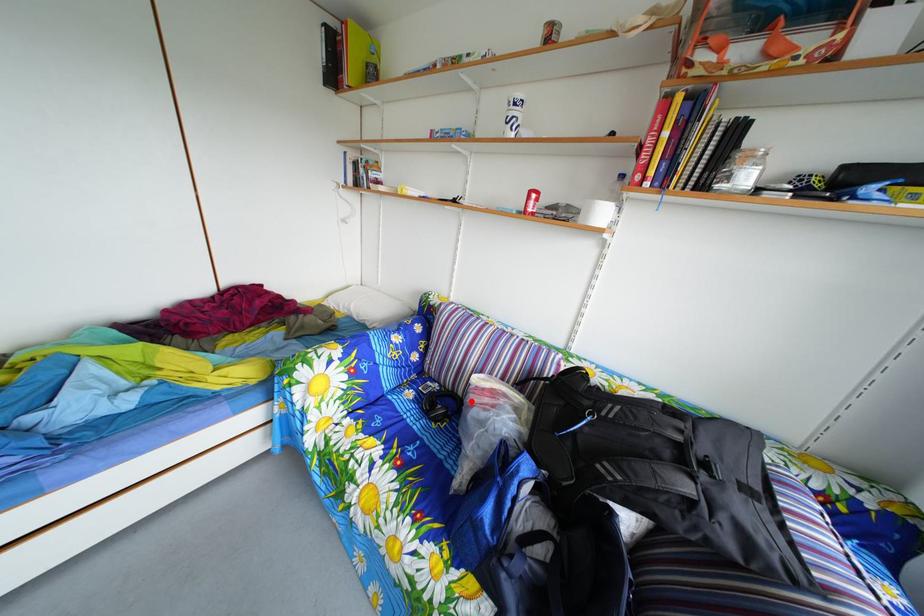
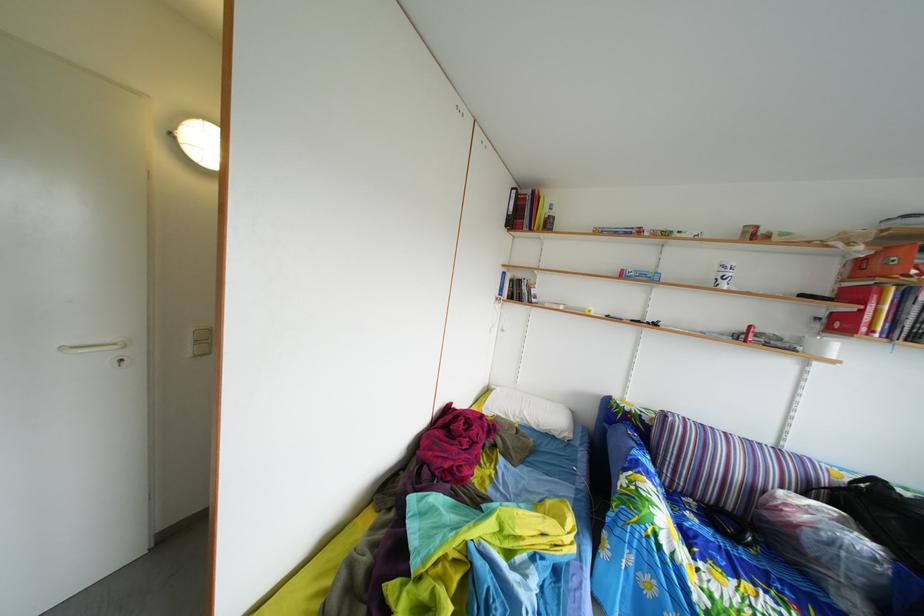
Question: I am providing you with two images of the same scene from different viewpoints. A red point is shown in image1. For the corresponding object point in image2, is it positioned nearer or farther from the camera?

Choices:
 (A) Nearer
 (B) Farther

Answer: (A)